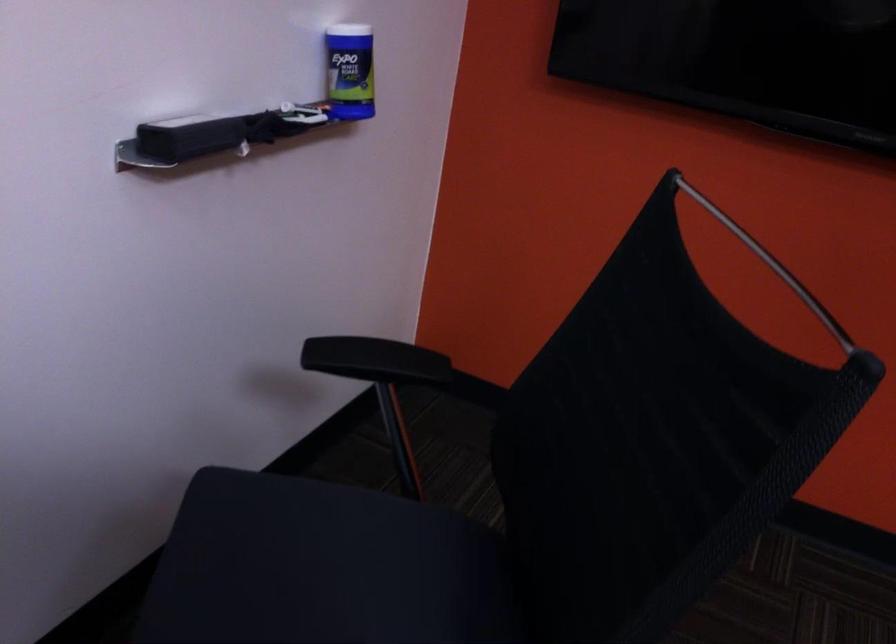
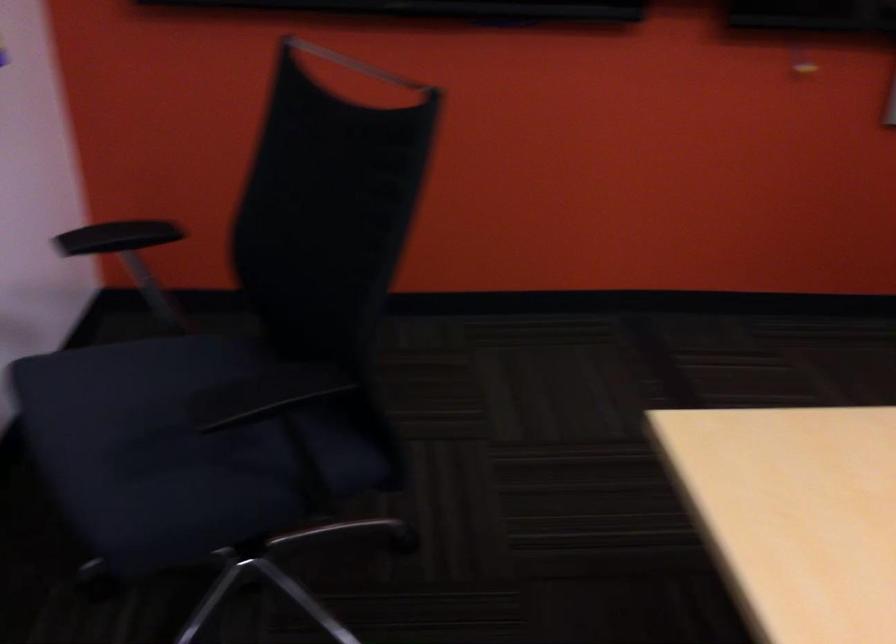
Where in the second image is the point corresponding to pixel 774 196 from the first image?

(356, 64)